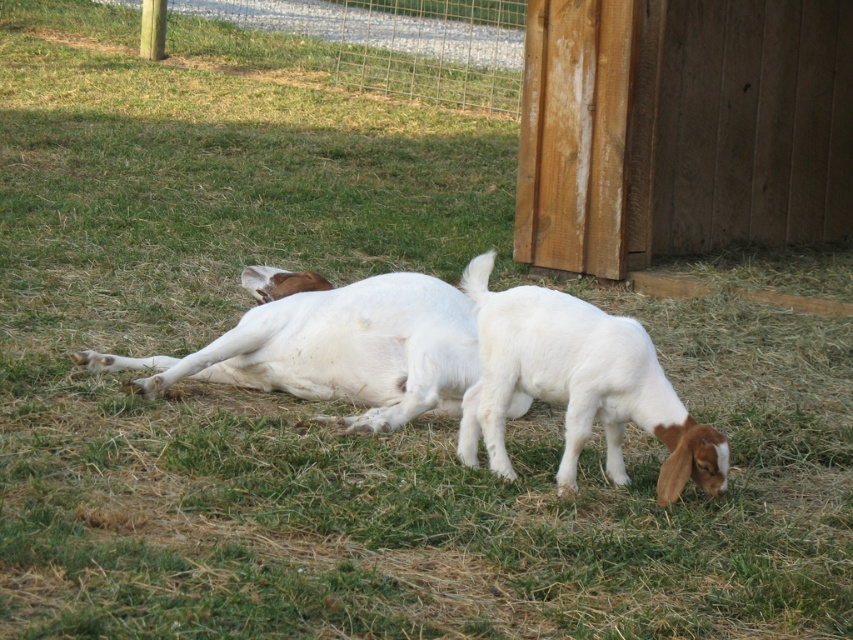
Who is positioned more to the left, wire mesh fence at upper center or white soft fur goat at center?

Positioned to the left is wire mesh fence at upper center.

Between wire mesh fence at upper center and white soft fur goat at center, which one appears on the right side from the viewer's perspective?

From the viewer's perspective, white soft fur goat at center appears more on the right side.

Which is in front, point (113, 38) or point (428, 337)?

Point (428, 337) is more forward.

What are the coordinates of `wire mesh fence at upper center` in the screenshot? It's located at (369, 44).

Between white soft fur goat at center and white fluffy goat at lower right, which one has less height?

white soft fur goat at center is shorter.

Between white soft fur goat at center and white fluffy goat at lower right, which one has more height?

white fluffy goat at lower right is taller.

The width and height of the screenshot is (853, 640). What are the coordinates of `white soft fur goat at center` in the screenshot? It's located at (339, 349).

Is wire mesh fence at upper center bigger than white fluffy goat at lower right?

Yes, wire mesh fence at upper center is bigger than white fluffy goat at lower right.

The height and width of the screenshot is (640, 853). Identify the location of wire mesh fence at upper center. (369, 44).